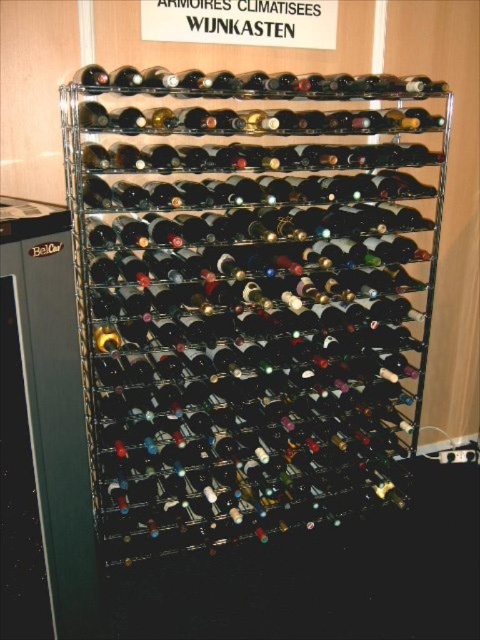
You are standing in front of the wine rack and want to reach both points. Which point, point (122,310) or point (96,106), will you reach first as you move forward?

Point (122,310) is further to the viewer than point (96,106), so you will reach point (122,310) first as you move forward.

You are a wine collector who wants to place a new matte black wine bottle at center into the black metal wine rack at center. Can the bottle fit inside the rack based on their widths?

The black metal wine rack at center is wider than the matte black wine bottle at center, so the bottle can fit inside the rack.